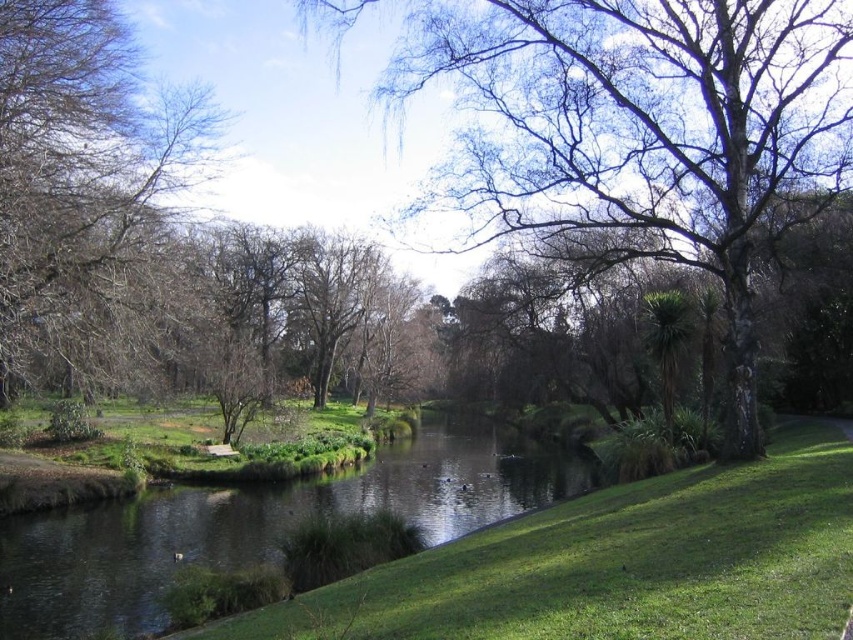
Who is positioned more to the left, bare branches at center or green grassy river at center?

From the viewer's perspective, green grassy river at center appears more on the left side.

Does bare branches at center have a smaller size compared to green grassy river at center?

Correct, bare branches at center occupies less space than green grassy river at center.

Identify the location of bare branches at center. [x=639, y=132].

Is point (613, 90) behind point (42, 289)?

No, (613, 90) is closer to viewer.

Is bare branches at center thinner than brown leafy tree at left?

In fact, bare branches at center might be wider than brown leafy tree at left.

Identify the location of bare branches at center. The height and width of the screenshot is (640, 853). (639, 132).

Between green grassy river at center and brown leafy tree at left, which one is positioned higher?

brown leafy tree at left

Who is positioned more to the left, green grassy river at center or brown leafy tree at left?

brown leafy tree at left is more to the left.

Does point (537, 449) come closer to viewer compared to point (6, 51)?

That is False.

Where is `green grassy river at center`? Image resolution: width=853 pixels, height=640 pixels. green grassy river at center is located at coordinates (260, 524).